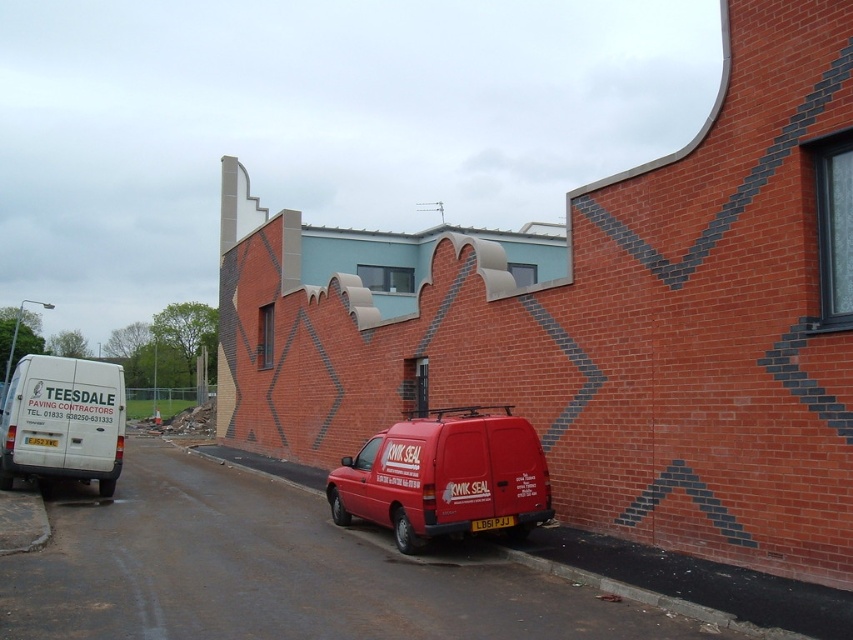
Does matte red van at center appear on the left side of white matte van at left?

Incorrect, matte red van at center is not on the left side of white matte van at left.

Is point (409, 468) farther from camera compared to point (45, 412)?

No, (409, 468) is closer to viewer.

Identify the location of matte red van at center. Image resolution: width=853 pixels, height=640 pixels. (445, 477).